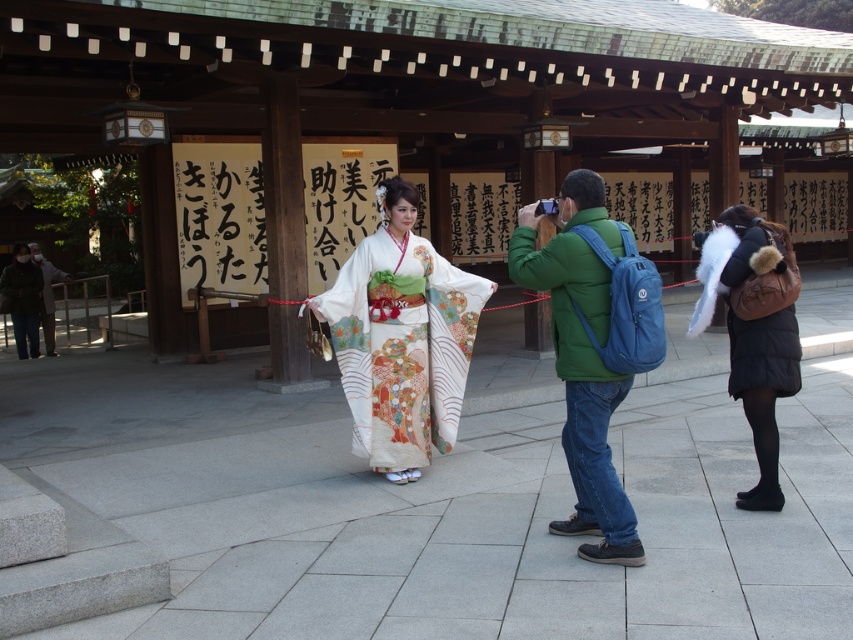
You are a photographer positioned at the front of the shrine. You need to capture a clear shot of both the green matte jacket at center and the dark gray fabric jacket at left. Which jacket should you focus on first to ensure both are in focus?

The green matte jacket at center is closer to the viewer than the dark gray fabric jacket at left. To ensure both are in focus, you should focus on the green matte jacket at center first, as it is closer, and adjust the depth of field accordingly.